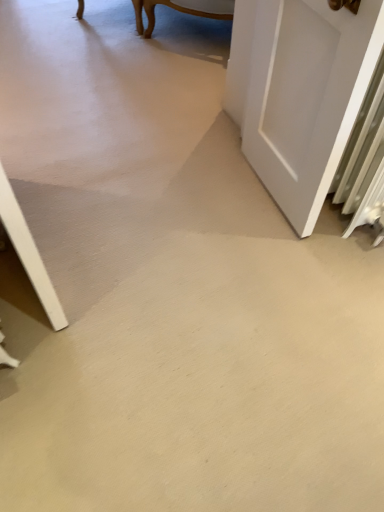
This screenshot has width=384, height=512. In order to click on free region on the left part of white matte door at right in this screenshot , I will do `click(192, 198)`.